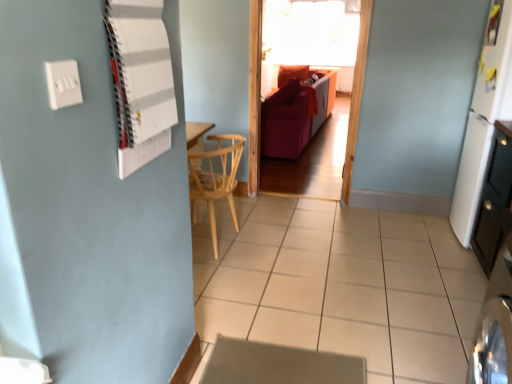
Locate an element on the screen. free space in front of natural wood chair at center is located at coordinates click(x=239, y=282).